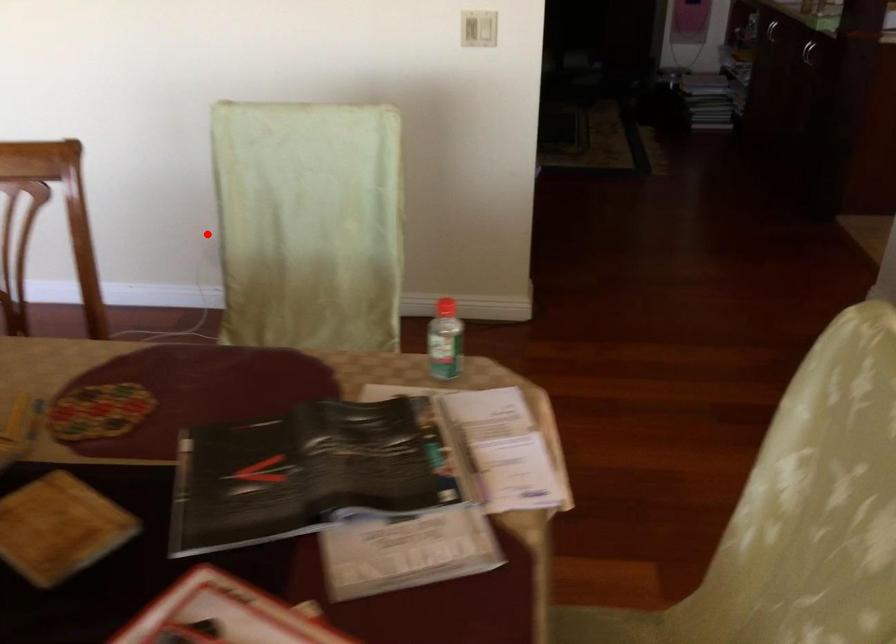
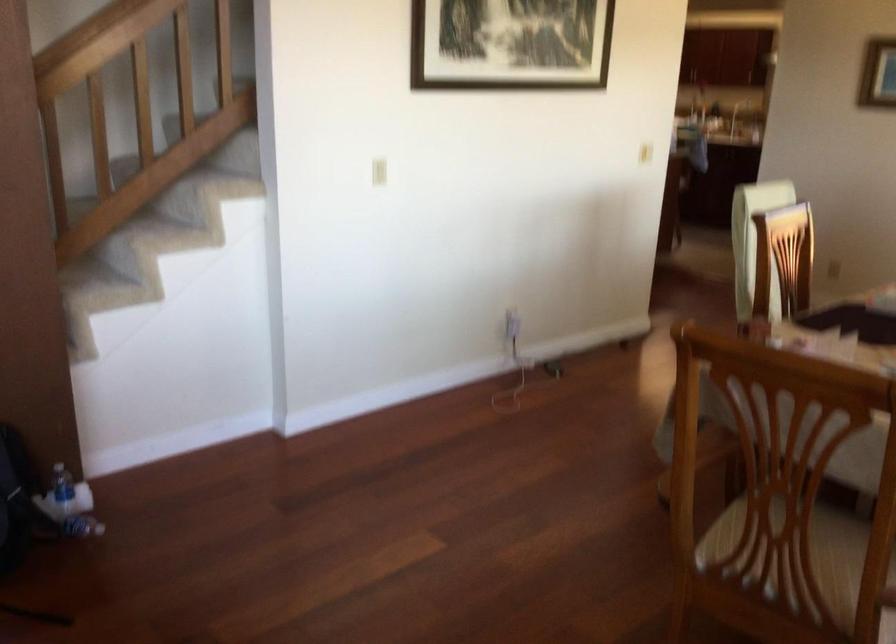
Question: I am providing you with two images of the same scene from different viewpoints. Image1 has a red point marked. In image2, the corresponding 3D location appears at what relative position? Reply with the corresponding letter.

Choices:
 (A) Closer
 (B) Farther

Answer: (B)